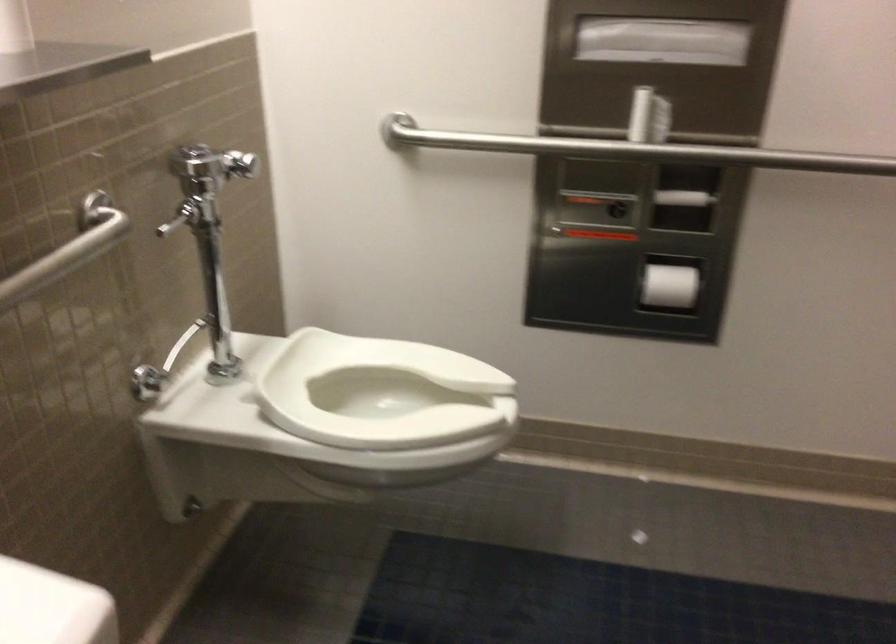
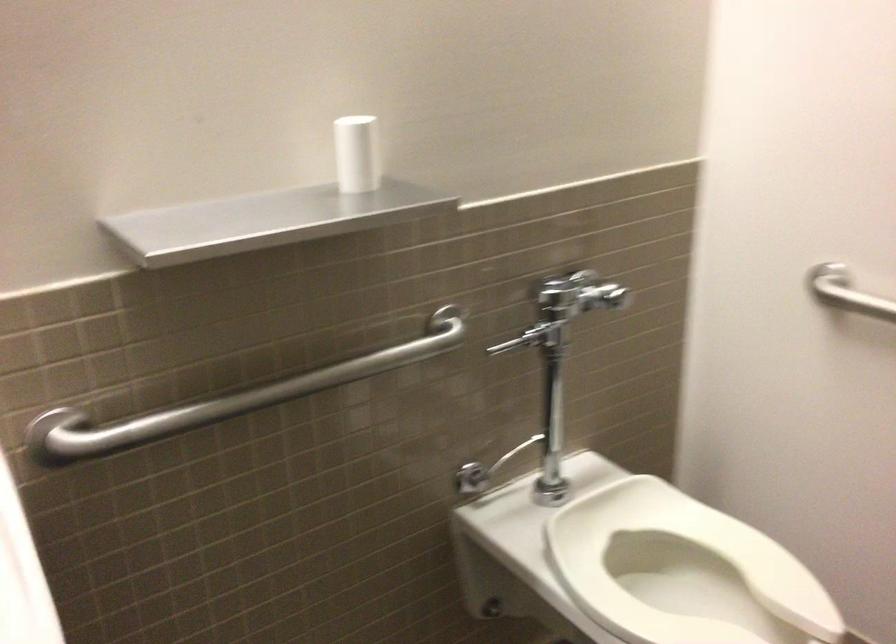
Question: The camera is either moving clockwise (left) or counter-clockwise (right) around the object. The first image is from the beginning of the video and the second image is from the end. Is the camera moving left or right when shooting the video?

Choices:
 (A) Left
 (B) Right

Answer: (B)